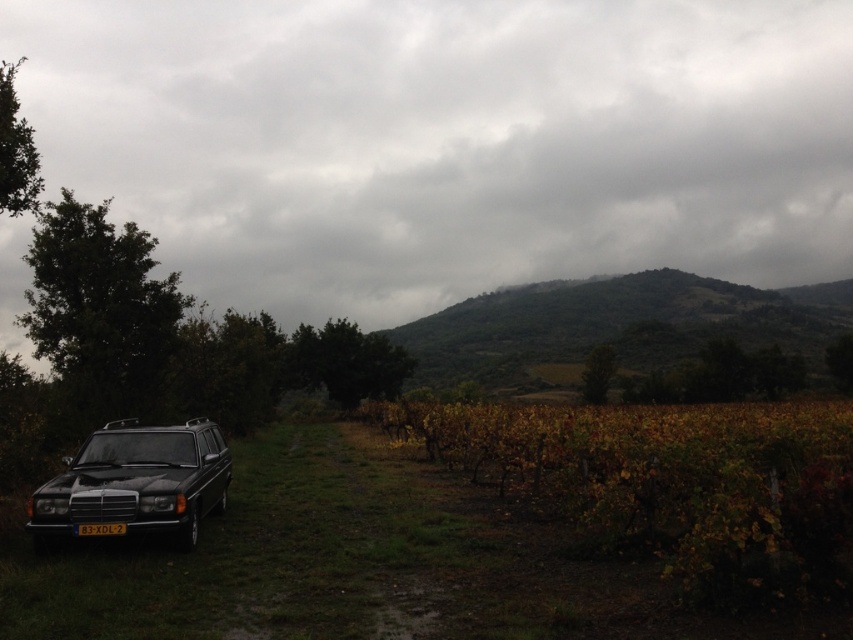
Is point (126, 504) positioned after point (86, 525)?

Yes, it is.

Is matte black station wagon at lower left behind black plastic license plate at lower left?

No, it is not.

What do you see at coordinates (136, 483) in the screenshot?
I see `matte black station wagon at lower left` at bounding box center [136, 483].

This screenshot has width=853, height=640. Find the location of `matte black station wagon at lower left`. matte black station wagon at lower left is located at coordinates (136, 483).